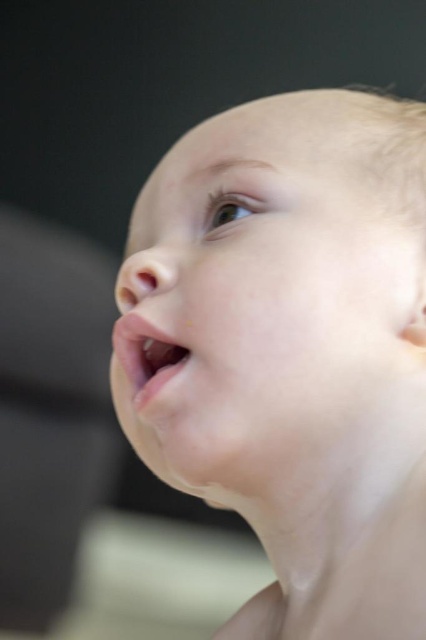
Question: Can you confirm if smooth skin face at center is positioned to the left of pink smooth lips at center?

Choices:
 (A) yes
 (B) no

Answer: (B)

Question: Can you confirm if smooth skin face at center is smaller than pink smooth lips at center?

Choices:
 (A) no
 (B) yes

Answer: (A)

Question: Is smooth skin face at center wider than pink smooth lips at center?

Choices:
 (A) yes
 (B) no

Answer: (A)

Question: Among these objects, which one is nearest to the camera?

Choices:
 (A) smooth skin face at center
 (B) pink smooth lips at center

Answer: (A)

Question: Which object is farther from the camera taking this photo?

Choices:
 (A) pink smooth lips at center
 (B) smooth skin face at center

Answer: (A)